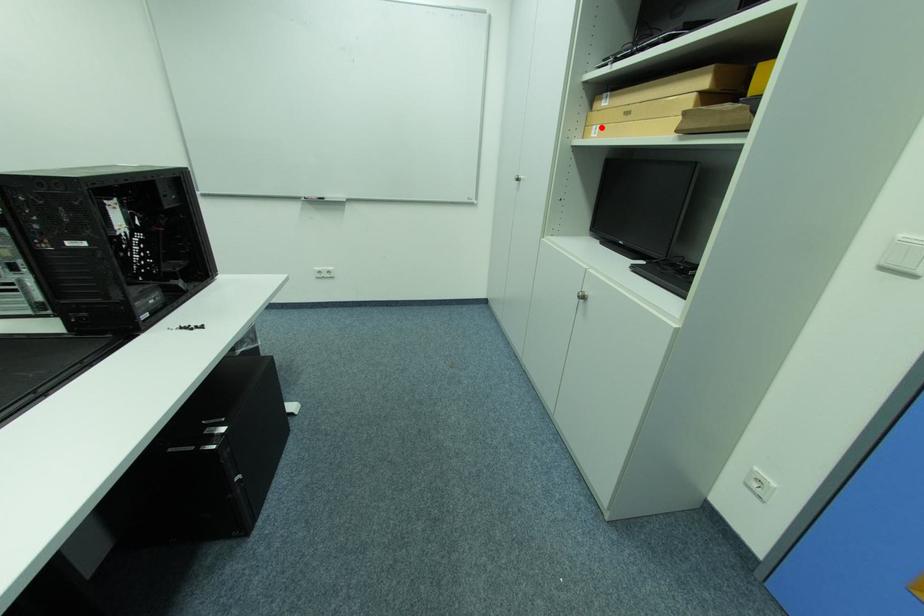
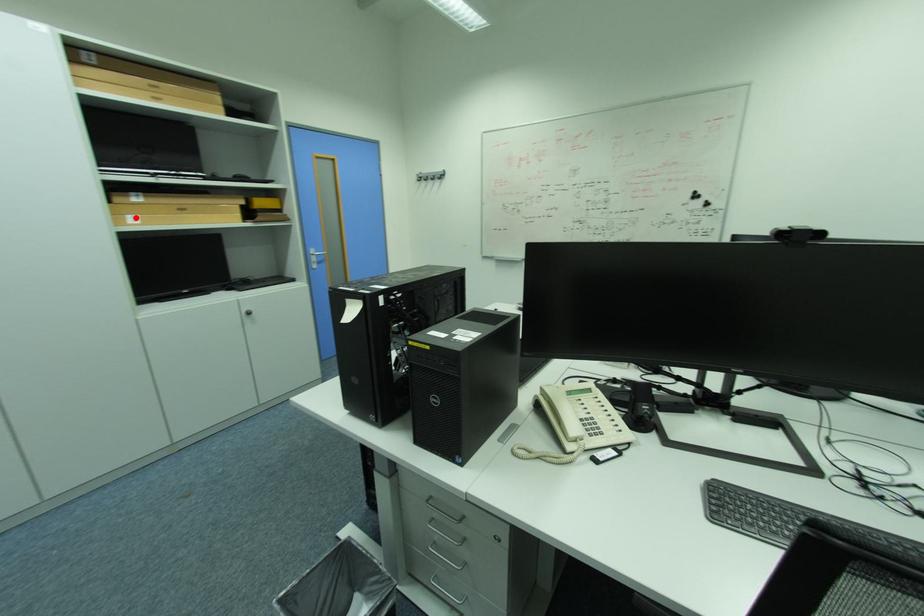
I am providing you with two images of the same scene from different viewpoints. A red point is marked on the first image and another point is marked on the second image. Is the marked point in image1 the same physical position as the marked point in image2?

Yes